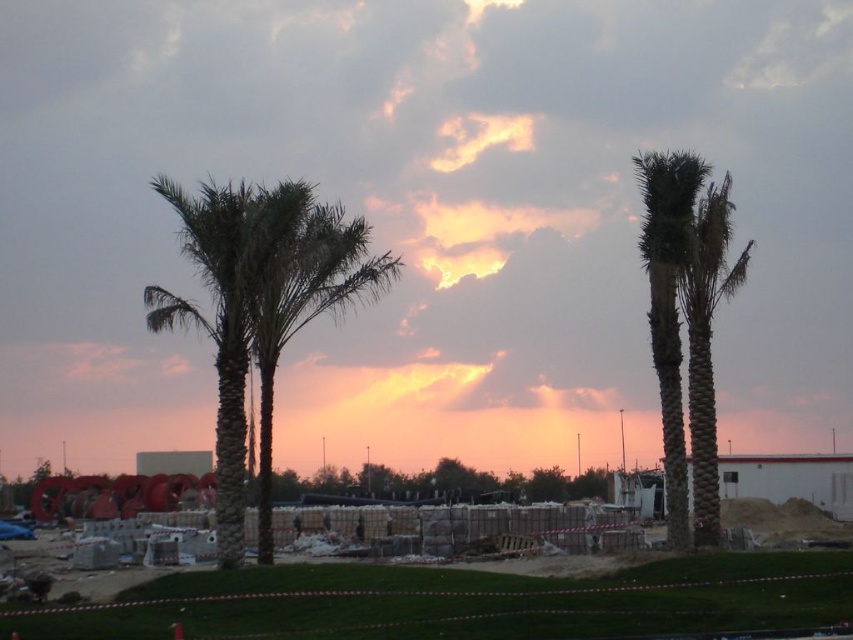
Question: Is green leafy palm at center smaller than green textured palm tree at right?

Choices:
 (A) yes
 (B) no

Answer: (B)

Question: Which point is farther to the camera?

Choices:
 (A) green textured palm tree at right
 (B) green leafy palm at center

Answer: (A)

Question: Does concrete blocks at center have a greater width compared to green leafy palm at center?

Choices:
 (A) no
 (B) yes

Answer: (A)

Question: Is concrete blocks at center closer to the viewer compared to green textured palm tree at right?

Choices:
 (A) yes
 (B) no

Answer: (A)

Question: Which of these objects is positioned closest to the concrete blocks at center?

Choices:
 (A) green textured palm tree at right
 (B) green leafy palm at center

Answer: (B)

Question: Among these objects, which one is nearest to the camera?

Choices:
 (A) green leafy palm at center
 (B) concrete blocks at center
 (C) green textured palm tree at right

Answer: (B)